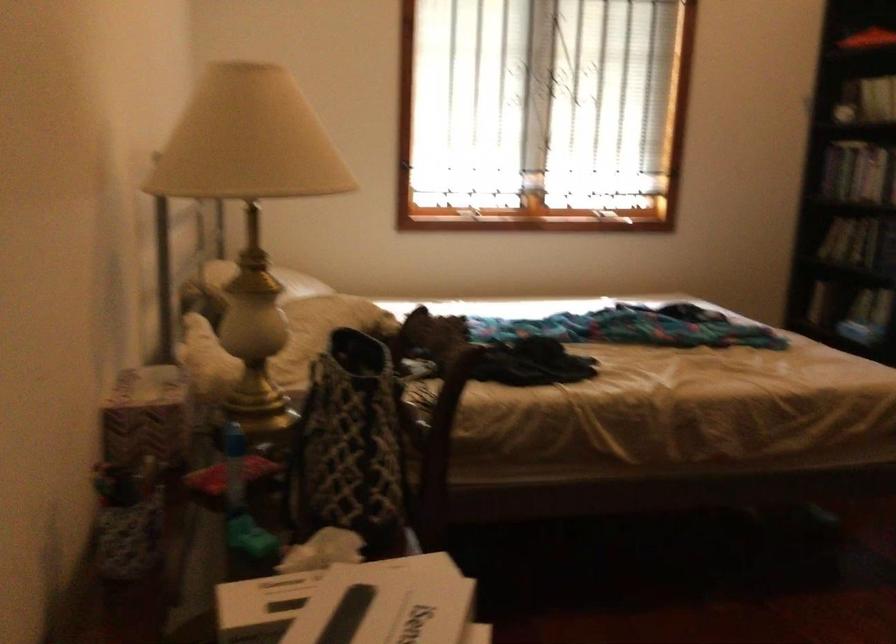
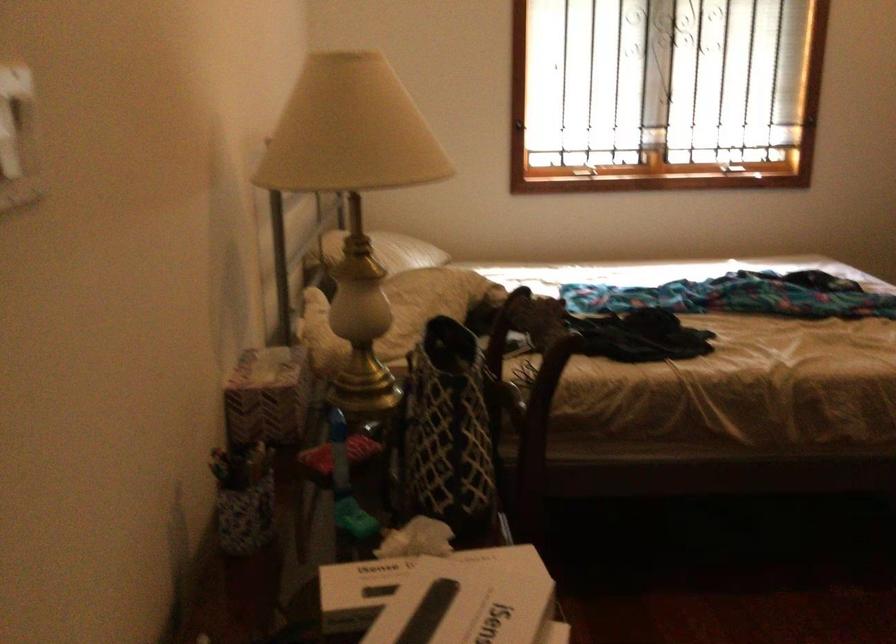
In the second image, find the point that corresponds to [405,161] in the first image.

(520, 124)